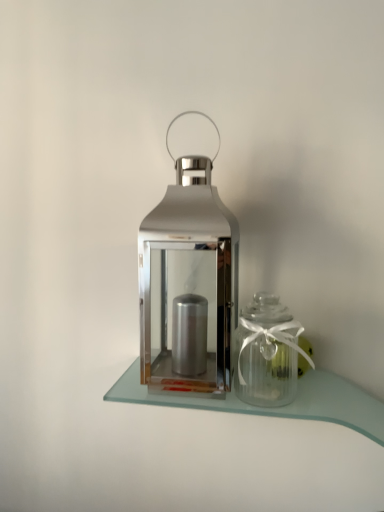
Identify the location of clear glass table at center. The height and width of the screenshot is (512, 384). (277, 407).

Measure the distance between point (165, 389) and camera.

The depth of point (165, 389) is 79.40 centimeters.

Locate an element on the screen. The height and width of the screenshot is (512, 384). clear glass jar at right is located at coordinates tap(266, 352).

Is clear glass table at center at the left side of clear glass jar at right?

Yes.

What's the angular difference between clear glass table at center and clear glass jar at right's facing directions?

The angular difference between clear glass table at center and clear glass jar at right is 0.323 degrees.

Considering the relative positions of clear glass table at center and clear glass jar at right in the image provided, is clear glass table at center in front of clear glass jar at right?

Yes, clear glass table at center is closer to the viewer.

Looking at this image, is clear glass table at center looking in the opposite direction of clear glass jar at right?

No, clear glass table at center's orientation is not away from clear glass jar at right.

Looking at this image, does shiny metallic lantern at center have a lesser height compared to clear glass jar at right?

No.

Are shiny metallic lantern at center and clear glass jar at right far apart?

No, shiny metallic lantern at center is in close proximity to clear glass jar at right.

Considering their positions, is shiny metallic lantern at center located in front of or behind clear glass jar at right?

shiny metallic lantern at center is positioned closer to the viewer than clear glass jar at right.

Which of these two, clear glass jar at right or shiny metallic lantern at center, is wider?

With larger width is shiny metallic lantern at center.

Is clear glass jar at right closer to camera compared to shiny metallic lantern at center?

No, clear glass jar at right is further to the viewer.

Is clear glass jar at right taller or shorter than shiny metallic lantern at center?

Considering their sizes, clear glass jar at right has less height than shiny metallic lantern at center.

Between point (268, 394) and point (188, 290), which one is positioned in front?

The point (268, 394) is closer to the camera.

Considering the sizes of shiny metallic lantern at center and clear glass table at center in the image, is shiny metallic lantern at center taller or shorter than clear glass table at center?

Considering their sizes, shiny metallic lantern at center has more height than clear glass table at center.

Is shiny metallic lantern at center oriented away from clear glass table at center?

No.

Based on the photo, how different are the orientations of shiny metallic lantern at center and clear glass table at center in degrees?

1.67 degrees.

Based on their sizes in the image, would you say shiny metallic lantern at center is bigger or smaller than clear glass table at center?

shiny metallic lantern at center is bigger than clear glass table at center.

From a real-world perspective, is clear glass jar at right beneath clear glass table at center?

No, from a real-world perspective, clear glass jar at right is not beneath clear glass table at center.

Considering the sizes of clear glass jar at right and clear glass table at center in the image, is clear glass jar at right taller or shorter than clear glass table at center?

clear glass jar at right is taller than clear glass table at center.

Is clear glass jar at right inside or outside of clear glass table at center?

clear glass jar at right lies outside clear glass table at center.

Find the location of a particular element. table that appears below the clear glass jar at right (from the image's perspective) is located at coordinates (277, 407).

Considering the relative sizes of clear glass table at center and shiny metallic lantern at center in the image provided, is clear glass table at center smaller than shiny metallic lantern at center?

Indeed, clear glass table at center has a smaller size compared to shiny metallic lantern at center.

Considering the relative sizes of clear glass table at center and shiny metallic lantern at center in the image provided, is clear glass table at center taller than shiny metallic lantern at center?

No.

Could you tell me if clear glass table at center is turned towards shiny metallic lantern at center?

No, clear glass table at center does not turn towards shiny metallic lantern at center.

You are a GUI agent. You are given a task and a screenshot of the screen. Output one action in this format:
    pyautogui.click(x=<x>, y=<y>)
    Task: Click on the glass vase that appears on the right of clear glass table at center
    The width and height of the screenshot is (384, 512).
    Given the screenshot: What is the action you would take?
    pyautogui.click(x=266, y=352)

This screenshot has height=512, width=384. In order to click on lantern above the clear glass jar at right (from the image's perspective) in this screenshot , I will do `click(188, 275)`.

Consider the image. When comparing their distances from shiny metallic lantern at center, does clear glass table at center or clear glass jar at right seem further?

Among the two, clear glass table at center is located further to shiny metallic lantern at center.

Considering their positions, is shiny metallic lantern at center positioned closer to clear glass jar at right than clear glass table at center?

Among the two, clear glass table at center is located nearer to clear glass jar at right.

Looking at this image, considering their positions, is clear glass jar at right positioned further to shiny metallic lantern at center than clear glass table at center?

Based on the image, clear glass table at center appears to be further to shiny metallic lantern at center.

Which object lies nearer to the anchor point clear glass table at center, shiny metallic lantern at center or clear glass jar at right?

Based on the image, clear glass jar at right appears to be nearer to clear glass table at center.

Considering their positions, is clear glass jar at right positioned closer to clear glass table at center than shiny metallic lantern at center?

clear glass jar at right is positioned closer to the anchor clear glass table at center.

Looking at the image, which one is located closer to clear glass jar at right, clear glass table at center or shiny metallic lantern at center?

clear glass table at center.

Where is `glass vase between shiny metallic lantern at center and clear glass table at center in the vertical direction`? The image size is (384, 512). glass vase between shiny metallic lantern at center and clear glass table at center in the vertical direction is located at coordinates (266, 352).